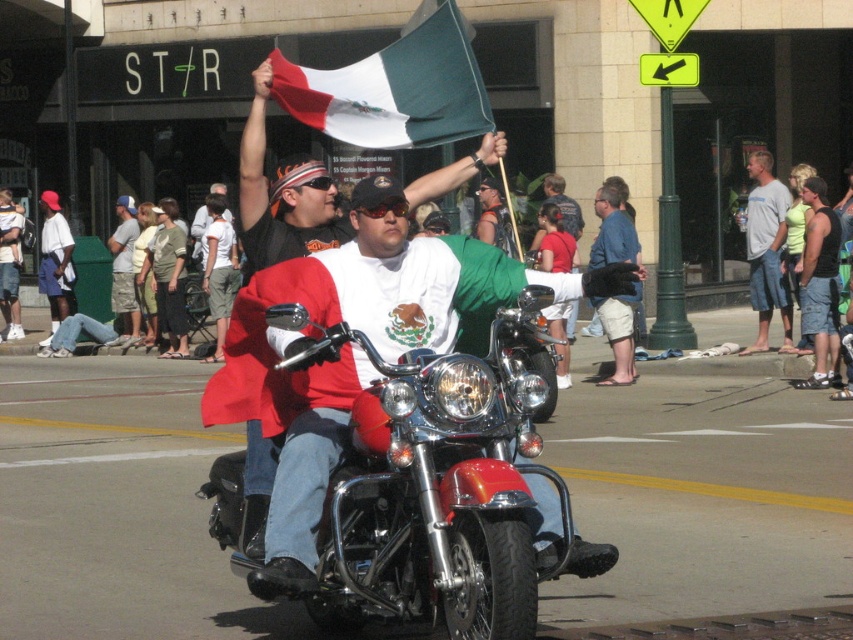
Question: Does beige shorts at center have a greater width compared to denim shorts at center?

Choices:
 (A) yes
 (B) no

Answer: (B)

Question: Does shiny chrome motorcycle at center have a lesser width compared to matte black motorcycle at center?

Choices:
 (A) no
 (B) yes

Answer: (A)

Question: Which of these objects is positioned farthest from the denim shorts at center?

Choices:
 (A) gray cotton t-shirt at center
 (B) beige shorts at center
 (C) matte black motorcycle at center
 (D) shiny chrome motorcycle at center

Answer: (D)

Question: In this image, where is shiny chrome motorcycle at center located relative to matte black motorcycle at center?

Choices:
 (A) above
 (B) below

Answer: (B)

Question: Which object is closer to the camera taking this photo?

Choices:
 (A) matte black motorcycle at center
 (B) green felt flag at upper center
 (C) beige shorts at center
 (D) gray cotton t-shirt at center

Answer: (B)

Question: Which point appears closest to the camera in this image?

Choices:
 (A) (128, 310)
 (B) (492, 628)

Answer: (B)